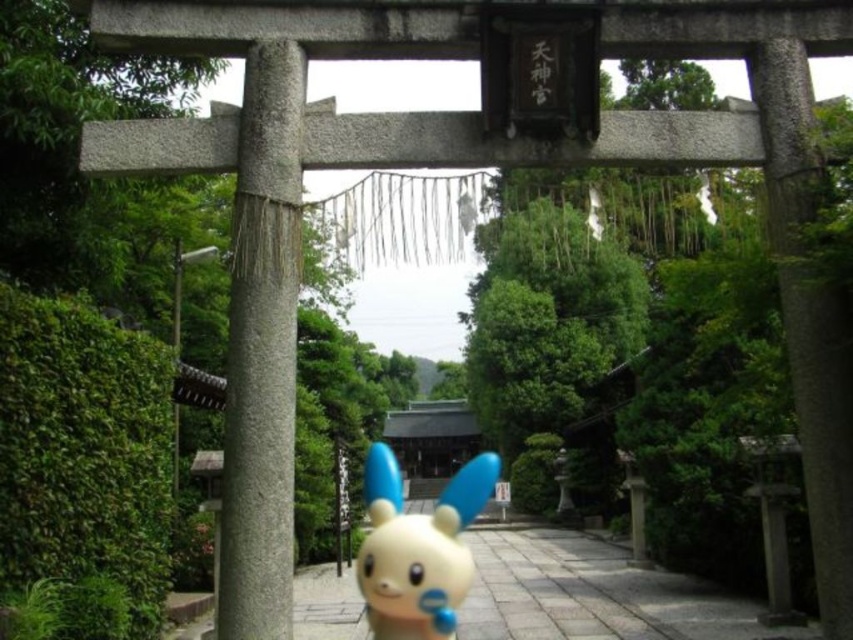
You are a visitor at the Shinto shrine and want to take a photo of the gray stone pillar at left and the yellow matte toy at center. Which object should you focus on first to ensure it appears larger in your photo?

The yellow matte toy at center should be focused on first because it is taller than the gray stone pillar at left, so it will appear larger in the photo.

You are standing in front of the traditional Japanese torii gate and want to place a 2.5 meter long banner between the gray stone pillar at left and the viewer. Is there enough space for the banner?

The distance between the gray stone pillar at left and the viewer is 4.62 meters, which is greater than the banner length of 2.5 meters. Therefore, there is enough space to place the banner between them.

You are standing at the entrance of the torii gate and see the white matte toy at center. If you walk straight ahead along the pathway, will the toy be in your direct line of sight or off to the side?

The white matte toy at center is positioned at point (x=595, y=593), which places it directly in front of you along the pathway. Therefore, it will be in your direct line of sight as you walk straight ahead.